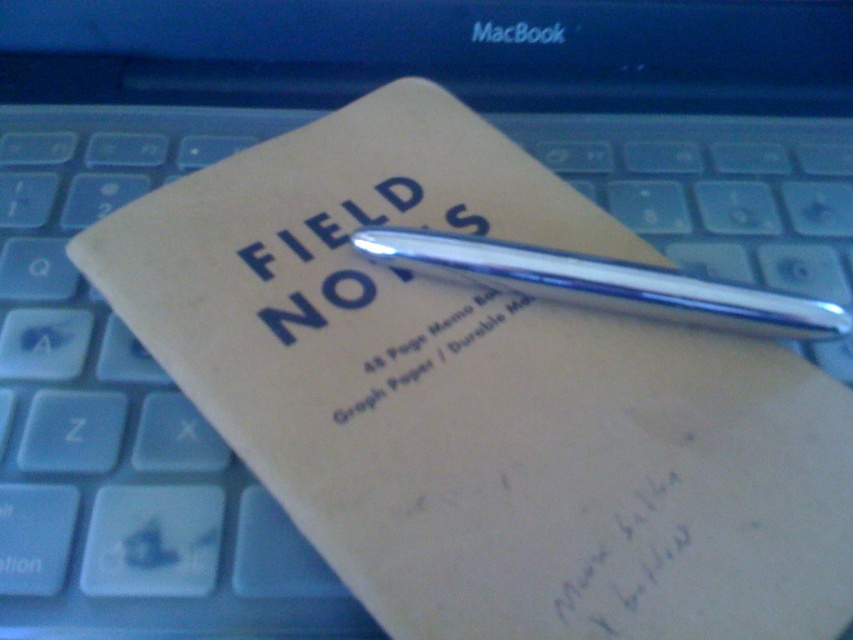
Is point (665, 296) positioned after point (515, 300)?

No, (665, 296) is in front of (515, 300).

Is chrome metallic pen at center to the right of white paper at center from the viewer's perspective?

Correct, you'll find chrome metallic pen at center to the right of white paper at center.

Between point (735, 291) and point (457, 403), which one is positioned in front?

Point (457, 403)

What are the coordinates of `chrome metallic pen at center` in the screenshot? It's located at (602, 284).

Who is more forward, (740, 308) or (628, 612)?

Point (628, 612) is in front.

Is chrome metallic pen at center shorter than matte black text at center?

Correct, chrome metallic pen at center is not as tall as matte black text at center.

Does point (703, 289) come behind point (682, 620)?

Yes.

The height and width of the screenshot is (640, 853). I want to click on chrome metallic pen at center, so click(x=602, y=284).

Between chrome metallic pen at center and silver metallic pen at center, which one has less height?

chrome metallic pen at center

Can you confirm if chrome metallic pen at center is shorter than silver metallic pen at center?

Yes, chrome metallic pen at center is shorter than silver metallic pen at center.

What do you see at coordinates (602, 284) in the screenshot? The image size is (853, 640). I see `chrome metallic pen at center` at bounding box center [602, 284].

Find the location of a particular element. The height and width of the screenshot is (640, 853). chrome metallic pen at center is located at coordinates (602, 284).